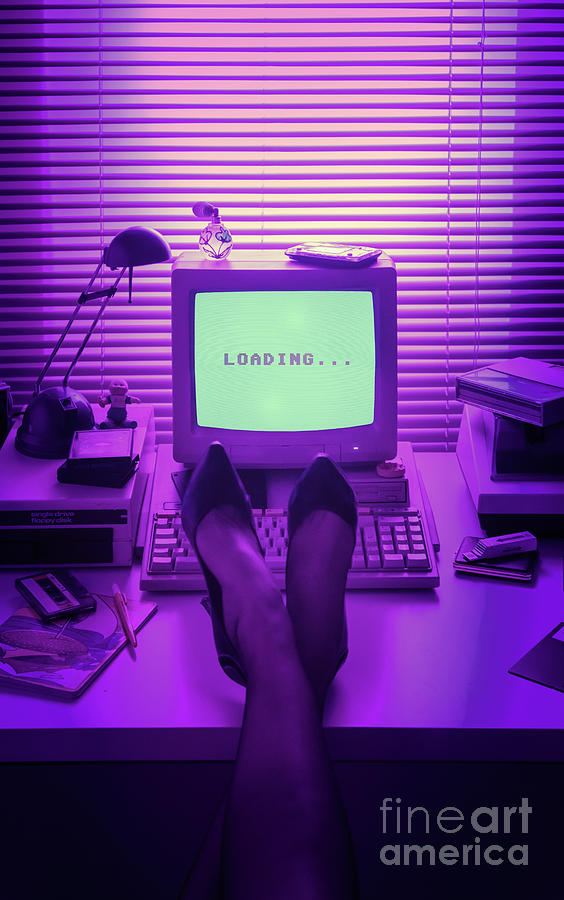
The width and height of the screenshot is (564, 900). I want to click on computer monitor, so click(x=232, y=320), click(x=329, y=399).